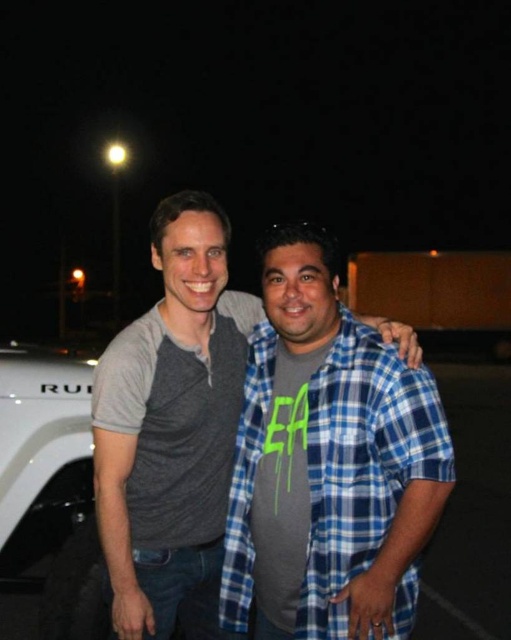
Question: Considering the relative positions of gray cotton shirt at center and brown matte pickup truck at center in the image provided, where is gray cotton shirt at center located with respect to brown matte pickup truck at center?

Choices:
 (A) left
 (B) right

Answer: (A)

Question: Which object is the farthest from the brown matte pickup truck at center?

Choices:
 (A) white matte vehicle at left
 (B) blue plaid shirt at center

Answer: (B)

Question: Does blue plaid shirt at center appear under brown matte pickup truck at center?

Choices:
 (A) yes
 (B) no

Answer: (A)

Question: Observing the image, what is the correct spatial positioning of gray cotton shirt at center in reference to blue plaid shirt at center?

Choices:
 (A) below
 (B) above

Answer: (B)

Question: Which of the following is the closest to the observer?

Choices:
 (A) (365, 484)
 (B) (150, 385)
 (C) (347, 268)

Answer: (A)

Question: Which point is farther to the camera?

Choices:
 (A) (184, 204)
 (B) (220, 602)

Answer: (B)